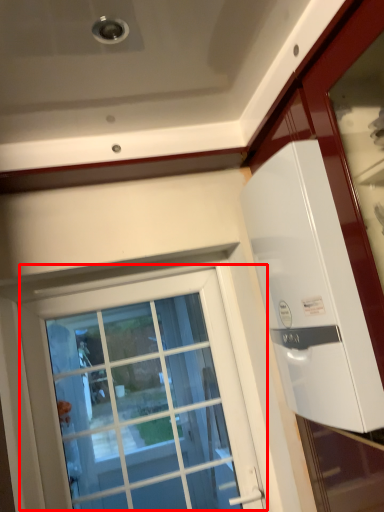
Question: From the image's perspective, what is the correct spatial relationship of window (annotated by the red box) in relation to appliance?

Choices:
 (A) above
 (B) below

Answer: (B)